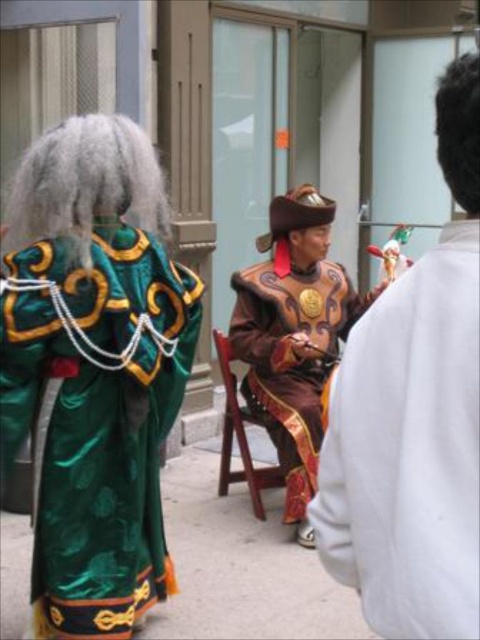
Question: From the image, what is the correct spatial relationship of green satin robe at left in relation to brown satin costume at center?

Choices:
 (A) above
 (B) below

Answer: (A)

Question: Is shiny brown leather hat at center behind gray synthetic wig at upper left?

Choices:
 (A) no
 (B) yes

Answer: (A)

Question: Which object is the farthest from the gray synthetic wig at upper left?

Choices:
 (A) brown satin costume at center
 (B) green satin robe at left

Answer: (A)

Question: Which of the following is the closest to the observer?

Choices:
 (A) brown satin costume at center
 (B) black fuzzy wig at upper right
 (C) shiny brown leather hat at center

Answer: (C)

Question: Among these points, which one is farthest from the camera?

Choices:
 (A) (241, 451)
 (B) (443, 173)
 (C) (291, 518)

Answer: (B)

Question: Does green satin robe at left have a smaller size compared to brown satin costume at center?

Choices:
 (A) yes
 (B) no

Answer: (B)